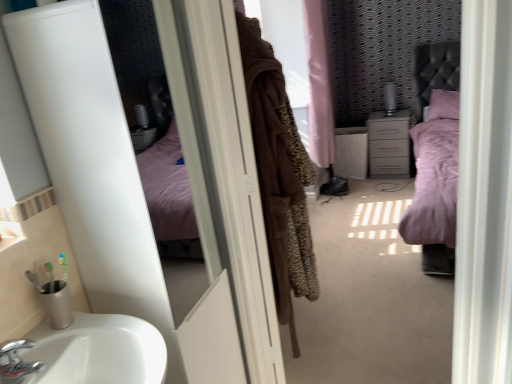
Question: From the image's perspective, is chrome metallic faucet at lower left positioned above or below white glossy screen door at upper left, which is the 1th screen door in left-to-right order?

Choices:
 (A) above
 (B) below

Answer: (B)

Question: Is chrome metallic faucet at lower left bigger or smaller than white glossy screen door at upper left, which is counted as the second screen door, starting from the right?

Choices:
 (A) big
 (B) small

Answer: (B)

Question: Estimate the real-world distances between objects in this image. Which object is farther from the matte gray chest of drawers at center?

Choices:
 (A) pink plush bed at center
 (B) brown fuzzy towel at center, acting as the first screen door starting from the right
 (C) chrome metallic faucet at lower left
 (D) white glossy screen door at upper left, which is the 1th screen door in left-to-right order
 (E) brown fuzzy coat at center

Answer: (C)

Question: Based on their relative distances, which object is farther from the brown fuzzy coat at center?

Choices:
 (A) pink plush bed at center
 (B) white glossy screen door at upper left, which is counted as the second screen door, starting from the right
 (C) matte gray chest of drawers at center
 (D) brown fuzzy towel at center, placed as the 2th screen door when sorted from left to right
 (E) chrome metallic faucet at lower left

Answer: (C)